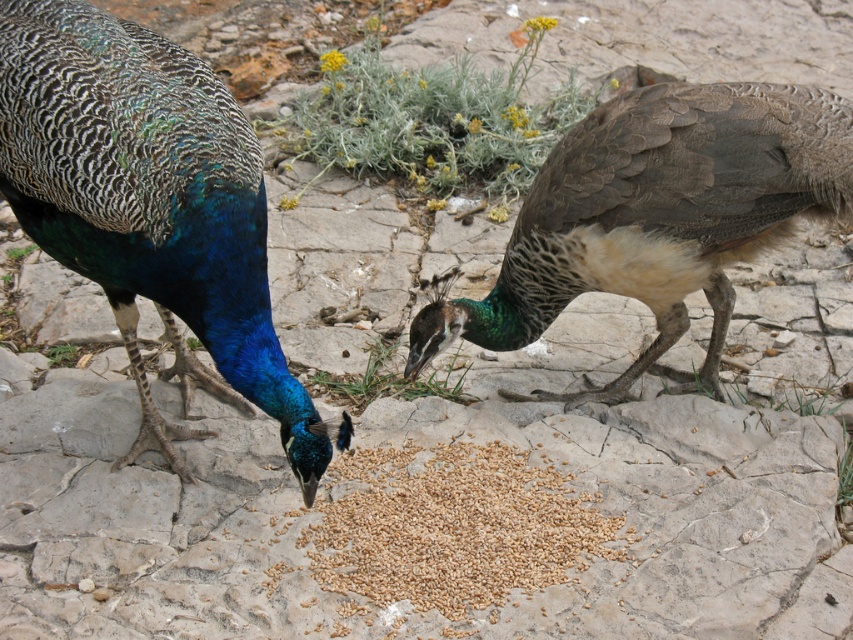
You are a birdwatcher observing two peacocks feeding on a rocky surface. You notice the brown textured peacock at right and the brown matte grain at center. Which peacock is closer to the grain?

The brown textured peacock at right is positioned on the right side of brown matte grain at center, so it is closer to the grain.

You are standing at the origin point of the image. You want to locate the shiny blue peacock at left. Which direction should you look in relation to the point marked at coordinates point (151,209)?

The point (151,209) marks the location of the shiny blue peacock at left, so you should look directly at that point to find it.

You are a wildlife photographer observing the two peacocks feeding on the grain. You want to capture a photo where the brown textured peacock at right is clearly visible next to the brown matte grain at center. Considering their sizes, which object should you focus on to ensure both are in frame without cropping?

The brown textured peacock at right is larger in size than the brown matte grain at center. To ensure both are in frame without cropping, focus on the brown textured peacock at right since it occupies more space, allowing the smaller grain to be captured alongside.